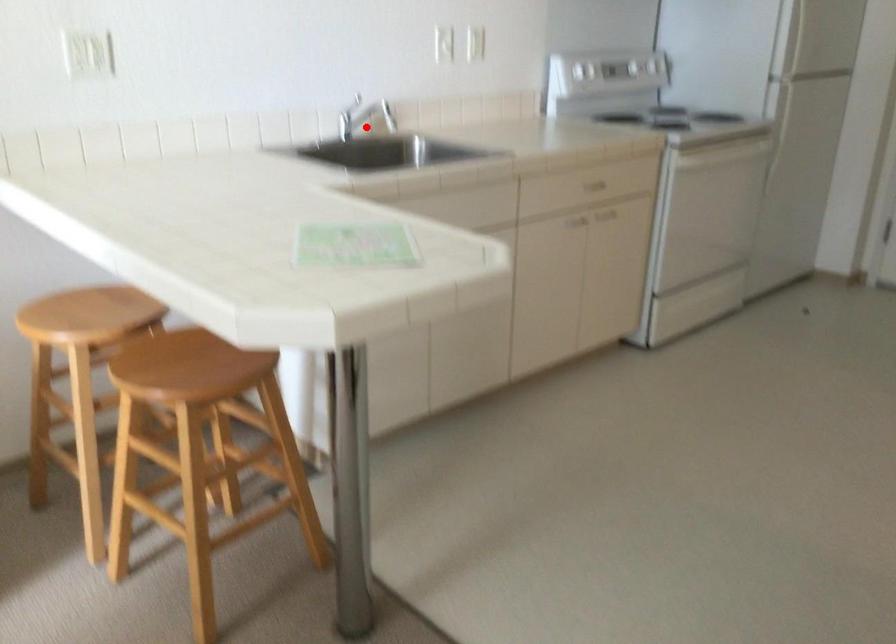
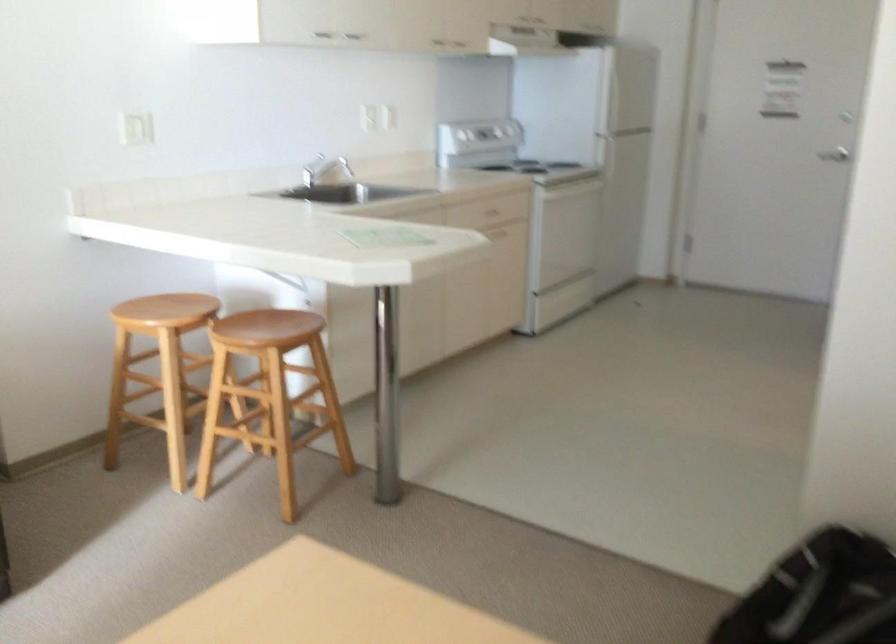
The point at the highlighted location is marked in the first image. Where is the corresponding point in the second image?

(317, 171)